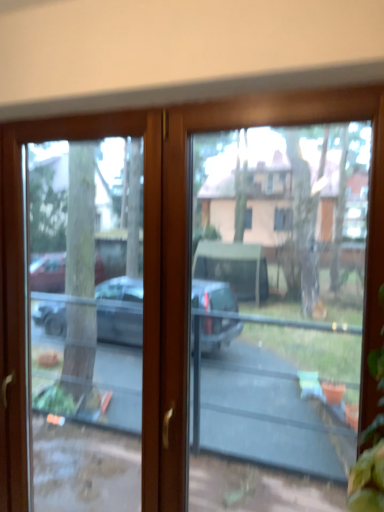
Describe the element at coordinates (281, 292) in the screenshot. I see `transparent glass door at center` at that location.

Where is `transparent glass door at center`? This screenshot has width=384, height=512. transparent glass door at center is located at coordinates (281, 292).

Measure the distance between point (x=283, y=270) and camera.

A distance of 6.69 feet exists between point (x=283, y=270) and camera.

This screenshot has width=384, height=512. Describe the element at coordinates (23, 270) in the screenshot. I see `transparent glass screen door at left` at that location.

This screenshot has height=512, width=384. In order to click on transparent glass screen door at left in this screenshot , I will do click(x=23, y=270).

Identify the location of transparent glass door at center. The height and width of the screenshot is (512, 384). (281, 292).

Is transparent glass door at center to the right of transparent glass screen door at left from the viewer's perspective?

Yes.

Does transparent glass door at center come behind transparent glass screen door at left?

No, transparent glass door at center is closer to the viewer.

Is point (308, 428) closer or farther from the camera than point (92, 129)?

Clearly, point (308, 428) is more distant from the camera than point (92, 129).

From the image's perspective, between transparent glass door at center and transparent glass screen door at left, who is located below?

transparent glass screen door at left appears lower in the image.

From a real-world perspective, between transparent glass door at center and transparent glass screen door at left, who is vertically lower?

From a 3D spatial view, transparent glass screen door at left is below.

Does transparent glass door at center have a lesser width compared to transparent glass screen door at left?

Incorrect, the width of transparent glass door at center is not less than that of transparent glass screen door at left.

Is transparent glass door at center taller or shorter than transparent glass screen door at left?

transparent glass door at center is shorter than transparent glass screen door at left.

Can you confirm if transparent glass door at center is bigger than transparent glass screen door at left?

Incorrect, transparent glass door at center is not larger than transparent glass screen door at left.

Could transparent glass screen door at left be considered to be inside transparent glass door at center?

Definitely not — transparent glass screen door at left is not inside transparent glass door at center.

Is transparent glass door at center next to transparent glass screen door at left?

There is a gap between transparent glass door at center and transparent glass screen door at left.

Is transparent glass door at center aimed at transparent glass screen door at left?

No, transparent glass door at center is not turned towards transparent glass screen door at left.

How different are the orientations of transparent glass door at center and transparent glass screen door at left in degrees?

There is a 0.331-degree angle between the facing directions of transparent glass door at center and transparent glass screen door at left.

How distant is transparent glass door at center from transparent glass screen door at left?

transparent glass door at center and transparent glass screen door at left are 5.08 feet apart from each other.

The height and width of the screenshot is (512, 384). What are the coordinates of `screen door located on the left of transparent glass door at center` in the screenshot? It's located at (23, 270).

Between transparent glass screen door at left and transparent glass door at center, which one appears on the right side from the viewer's perspective?

Positioned to the right is transparent glass door at center.

Does transparent glass screen door at left come in front of transparent glass door at center?

No, it is behind transparent glass door at center.

Considering the points (147, 457) and (254, 244), which point is in front, point (147, 457) or point (254, 244)?

The point (147, 457) is closer to the camera.

From the image's perspective, which object appears higher, transparent glass screen door at left or transparent glass door at center?

transparent glass door at center.

From a real-world perspective, which is physically below, transparent glass screen door at left or transparent glass door at center?

transparent glass screen door at left.

Which of these two, transparent glass screen door at left or transparent glass door at center, is wider?

With larger width is transparent glass door at center.

Considering the relative sizes of transparent glass screen door at left and transparent glass door at center in the image provided, is transparent glass screen door at left taller than transparent glass door at center?

Yes.

Considering the relative sizes of transparent glass screen door at left and transparent glass door at center in the image provided, is transparent glass screen door at left bigger than transparent glass door at center?

Yes, transparent glass screen door at left is bigger than transparent glass door at center.

Is transparent glass door at center a part of transparent glass screen door at left?

That's incorrect, transparent glass door at center is not inside transparent glass screen door at left.

Is transparent glass screen door at left far away from transparent glass door at center?

Yes.

Is transparent glass screen door at left facing away from transparent glass door at center?

No, transparent glass door at center is not at the back of transparent glass screen door at left.

The width and height of the screenshot is (384, 512). I want to click on bay window above the transparent glass screen door at left (from the image's perspective), so click(x=281, y=292).

Where is `screen door below the transparent glass door at center (from the image's perspective)`? screen door below the transparent glass door at center (from the image's perspective) is located at coordinates (23, 270).

At what (x,y) coordinates should I click in order to perform the action: click on screen door on the left of transparent glass door at center. Please return your answer as a coordinate pair (x, y). Image resolution: width=384 pixels, height=512 pixels. Looking at the image, I should click on (23, 270).